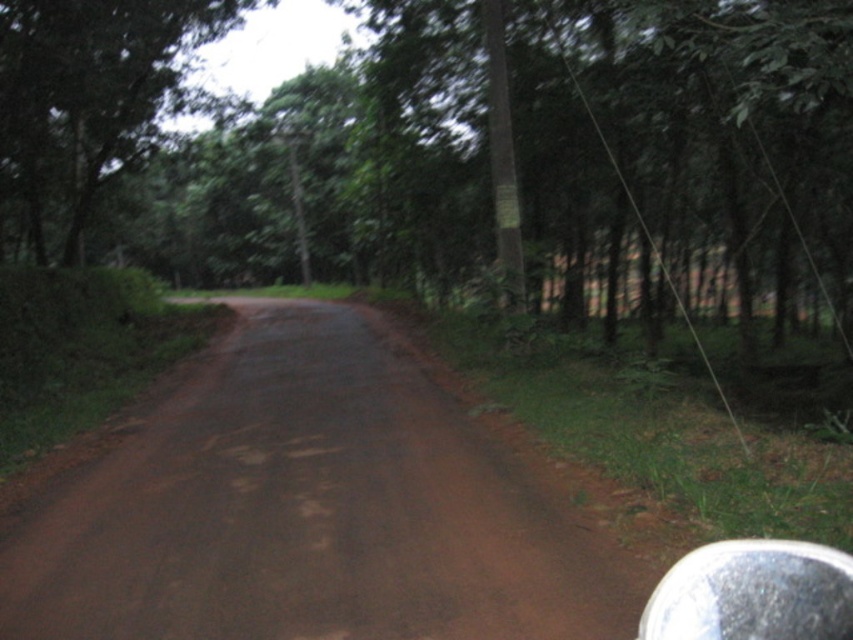
This screenshot has height=640, width=853. I want to click on brown dirt track at center, so click(309, 509).

Between point (155, 524) and point (614, 170), which one is positioned behind?

Positioned behind is point (614, 170).

At what (x,y) coordinates should I click in order to perform the action: click on brown dirt track at center. Please return your answer as a coordinate pair (x, y). Looking at the image, I should click on (309, 509).

Who is more forward, (26, 195) or (538, 3)?

Point (538, 3) is in front.

Does green leafy tree at upper left come in front of green matte tree at right?

No, it is behind green matte tree at right.

Describe the element at coordinates (86, 104) in the screenshot. This screenshot has width=853, height=640. I see `green leafy tree at upper left` at that location.

The height and width of the screenshot is (640, 853). In order to click on green leafy tree at upper left in this screenshot , I will do `click(86, 104)`.

Is brown dirt track at center smaller than green leafy tree at upper left?

Yes, brown dirt track at center is smaller than green leafy tree at upper left.

Is point (86, 557) positioned behind point (131, 154)?

No, it is not.

Where is `brown dirt track at center`? The height and width of the screenshot is (640, 853). brown dirt track at center is located at coordinates (309, 509).